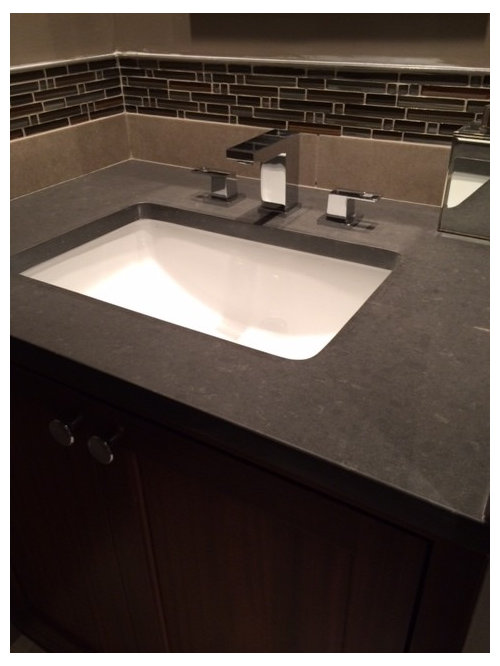
Where is `container to hold soap to be dispensed`? Image resolution: width=500 pixels, height=666 pixels. container to hold soap to be dispensed is located at coordinates (463, 182).